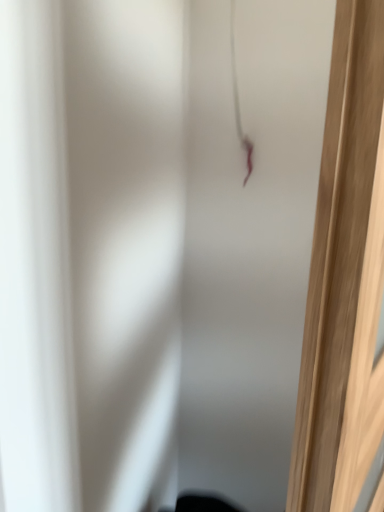
Find the location of a particular element. wooden door at right is located at coordinates (344, 278).

This screenshot has height=512, width=384. What do you see at coordinates (344, 278) in the screenshot?
I see `wooden door at right` at bounding box center [344, 278].

What is the approximate height of wooden door at right?

It is 1.25 meters.

Image resolution: width=384 pixels, height=512 pixels. I want to click on wooden door at right, so click(344, 278).